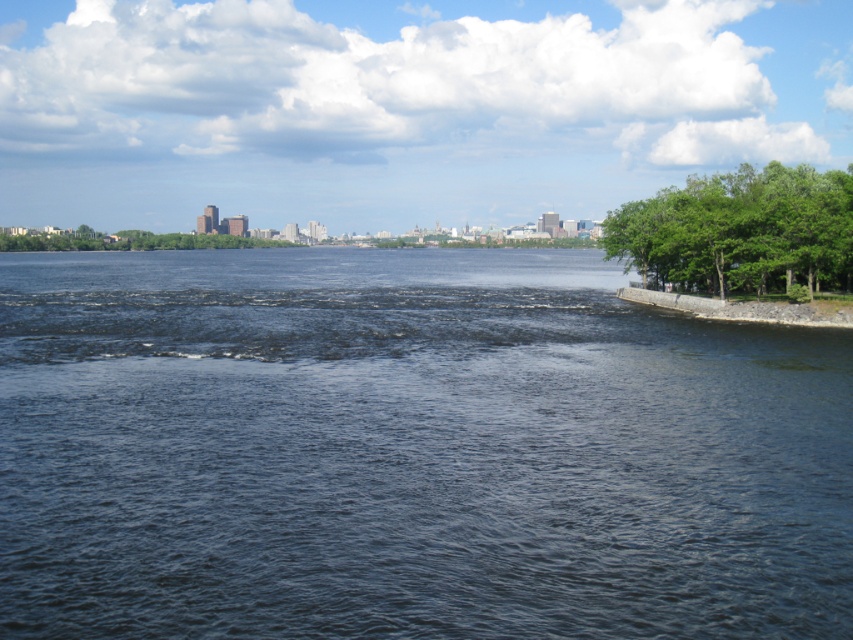
Question: Is dark blue water at center below green leafy trees at right?

Choices:
 (A) yes
 (B) no

Answer: (A)

Question: Considering the real-world distances, which object is farthest from the green leafy trees at right?

Choices:
 (A) dark blue water at center
 (B) smooth concrete wall at right
 (C) green leafy trees at center

Answer: (C)

Question: Estimate the real-world distances between objects in this image. Which object is closer to the smooth concrete wall at right?

Choices:
 (A) green leafy trees at right
 (B) green leafy trees at center

Answer: (A)

Question: Which of the following is the closest to the observer?

Choices:
 (A) (73, 244)
 (B) (815, 323)
 (C) (682, 476)

Answer: (C)

Question: Does green leafy trees at right appear over smooth concrete wall at right?

Choices:
 (A) yes
 (B) no

Answer: (A)

Question: Is green leafy trees at right to the right of smooth concrete wall at right from the viewer's perspective?

Choices:
 (A) yes
 (B) no

Answer: (A)